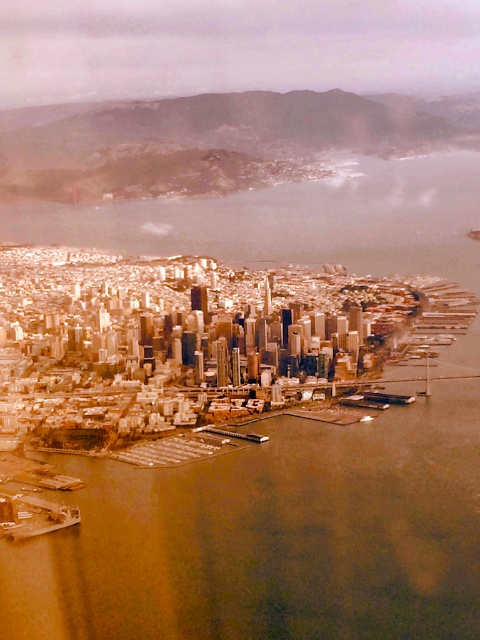
You are a delivery drone operator planning to land your drone between the metallic gray boat at lower left and the white plastic boat at lower right. The drone requires a minimum of 3 meters of space to land safely. Can you determine if there is enough space between them?

The metallic gray boat at lower left might be wider than white plastic boat at lower right, but without knowing the exact width difference, it is uncertain if the space between them meets the 3 meters requirement. Further measurement is needed to ensure safe landing.

You are a delivery drone flying over the city. You need to land on the white plastic boat at lower right. Is the brown water at center between you and the boat?

The brown water at center is below the white plastic boat at lower right, so yes, the brown water at center is between you and the boat.